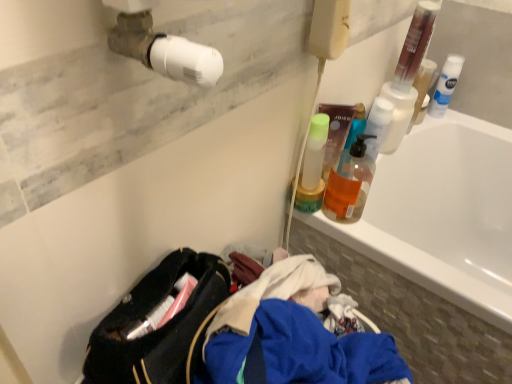
Question: Does translucent plastic pump bottle at upper right, arranged as the 1th cleaning product when ordered from the bottom, have a greater width compared to translucent orange liquid at upper right?

Choices:
 (A) no
 (B) yes

Answer: (A)

Question: Is translucent plastic pump bottle at upper right, acting as the second cleaning product starting from the top, thinner than translucent orange liquid at upper right?

Choices:
 (A) no
 (B) yes

Answer: (B)

Question: Is translucent plastic pump bottle at upper right, the 1th cleaning product positioned from the left, oriented away from translucent orange liquid at upper right?

Choices:
 (A) no
 (B) yes

Answer: (A)

Question: Would you say translucent plastic pump bottle at upper right, the first cleaning product positioned from the front, contains translucent orange liquid at upper right?

Choices:
 (A) no
 (B) yes

Answer: (A)

Question: Is translucent plastic pump bottle at upper right, placed as the 2th cleaning product when sorted from right to left, facing towards translucent orange liquid at upper right?

Choices:
 (A) yes
 (B) no

Answer: (B)

Question: From the image's perspective, would you say translucent plastic pump bottle at upper right, arranged as the 1th cleaning product when ordered from the bottom, is shown under white glossy bathtub at upper right?

Choices:
 (A) yes
 (B) no

Answer: (B)

Question: Does translucent plastic pump bottle at upper right, the first cleaning product positioned from the front, have a larger size compared to white glossy bathtub at upper right?

Choices:
 (A) yes
 (B) no

Answer: (B)

Question: From a real-world perspective, is translucent plastic pump bottle at upper right, placed as the 2th cleaning product when sorted from right to left, beneath white glossy bathtub at upper right?

Choices:
 (A) no
 (B) yes

Answer: (A)

Question: Can you confirm if translucent plastic pump bottle at upper right, acting as the 2th cleaning product starting from the back, is thinner than white glossy bathtub at upper right?

Choices:
 (A) yes
 (B) no

Answer: (A)

Question: Can you confirm if translucent plastic pump bottle at upper right, placed as the 2th cleaning product when sorted from right to left, is positioned to the right of white glossy bathtub at upper right?

Choices:
 (A) no
 (B) yes

Answer: (A)

Question: Is the position of translucent plastic pump bottle at upper right, placed as the 2th cleaning product when sorted from right to left, more distant than that of white glossy bathtub at upper right?

Choices:
 (A) no
 (B) yes

Answer: (B)

Question: From a real-world perspective, is white glossy bathtub at upper right over translucent plastic pump bottle at upper right, acting as the 2th cleaning product starting from the back?

Choices:
 (A) yes
 (B) no

Answer: (B)